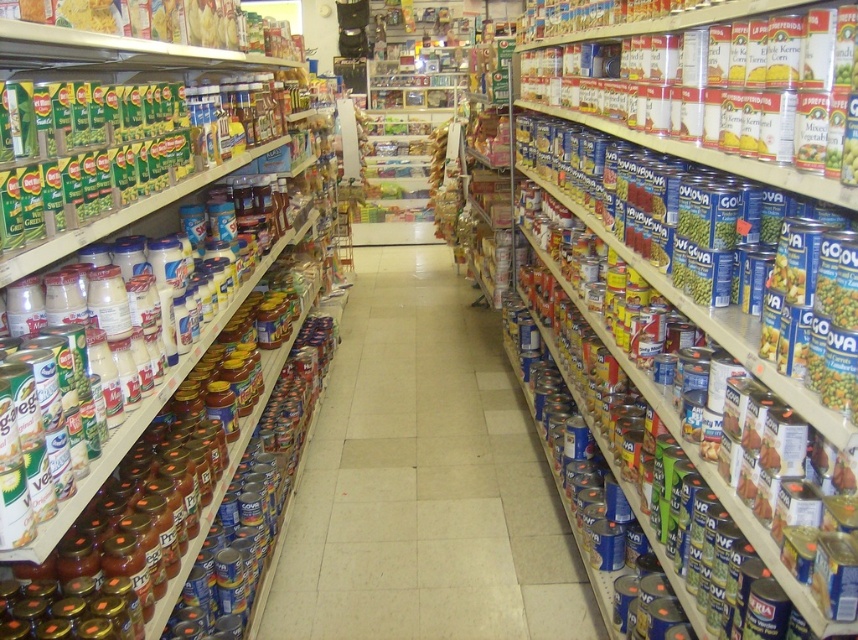
Question: Which of the following is the farthest from the observer?

Choices:
 (A) (396, 564)
 (B) (15, 316)

Answer: (A)

Question: Observing the image, what is the correct spatial positioning of metallic cans at left in reference to metallic cans at center?

Choices:
 (A) left
 (B) right

Answer: (A)

Question: Which point is closer to the camera?

Choices:
 (A) (113, 170)
 (B) (442, 554)

Answer: (A)

Question: Is metallic cans at left positioned behind metallic cans at center?

Choices:
 (A) yes
 (B) no

Answer: (B)

Question: From the image, what is the correct spatial relationship of metallic cans at left in relation to metallic cans at center?

Choices:
 (A) right
 (B) left

Answer: (B)